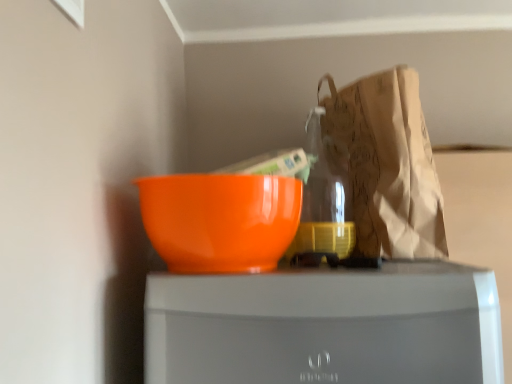
Locate an element on the screen. The width and height of the screenshot is (512, 384). brown paper bag at upper right is located at coordinates (388, 164).

This screenshot has width=512, height=384. What do you see at coordinates (388, 164) in the screenshot?
I see `brown paper bag at upper right` at bounding box center [388, 164].

Identify the location of brown paper bag at upper right. [388, 164].